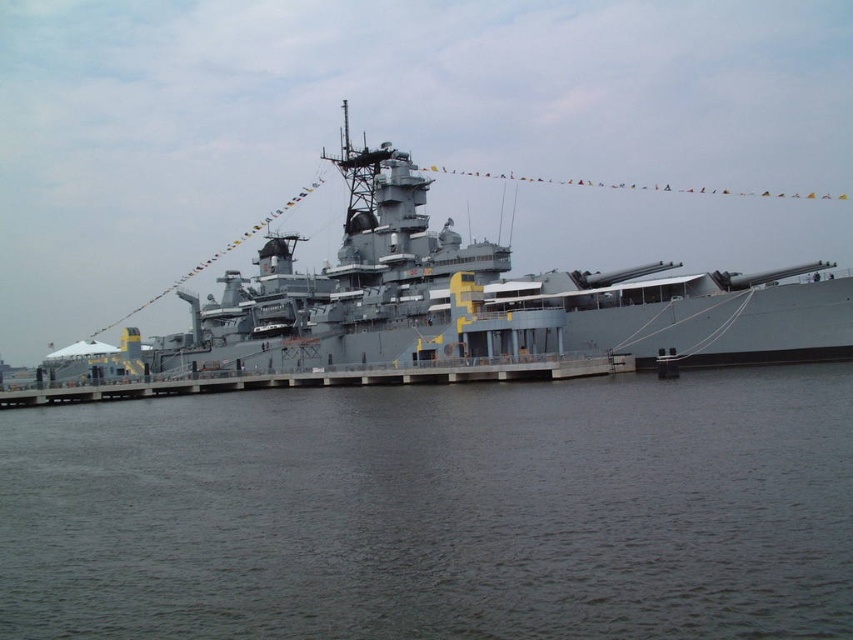
Does point (726, 481) come in front of point (280, 307)?

Yes, it is.

Is dark gray water at lower center closer to camera compared to gray metallic battleship at center?

That is True.

Is point (189, 560) positioned in front of point (329, 314)?

Yes, it is.

Where is `dark gray water at lower center`? The image size is (853, 640). dark gray water at lower center is located at coordinates (437, 512).

Is gray metallic battleship at center to the left of gray concrete dock at center from the viewer's perspective?

In fact, gray metallic battleship at center is to the right of gray concrete dock at center.

Does gray metallic battleship at center have a larger size compared to gray concrete dock at center?

Yes, gray metallic battleship at center is bigger than gray concrete dock at center.

Where is `gray metallic battleship at center`? gray metallic battleship at center is located at coordinates (465, 300).

Is dark gray water at lower center to the left of gray concrete dock at center from the viewer's perspective?

Incorrect, dark gray water at lower center is not on the left side of gray concrete dock at center.

Between dark gray water at lower center and gray concrete dock at center, which one has less height?

gray concrete dock at center is shorter.

Identify the location of dark gray water at lower center. Image resolution: width=853 pixels, height=640 pixels. (437, 512).